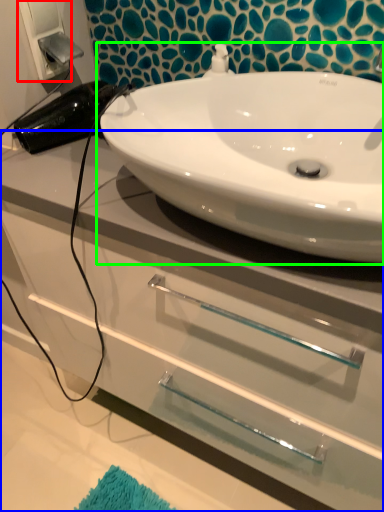
Question: Considering the real-world distances, which object is farthest from electric outlet (highlighted by a red box)? bathroom cabinet (highlighted by a blue box) or sink (highlighted by a green box)?

Choices:
 (A) bathroom cabinet
 (B) sink

Answer: (A)